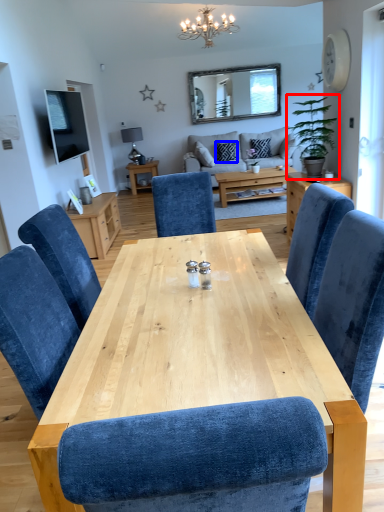
Question: Which point is closer to the camera, houseplant (highlighted by a red box) or pillow (highlighted by a blue box)?

Choices:
 (A) houseplant
 (B) pillow

Answer: (A)